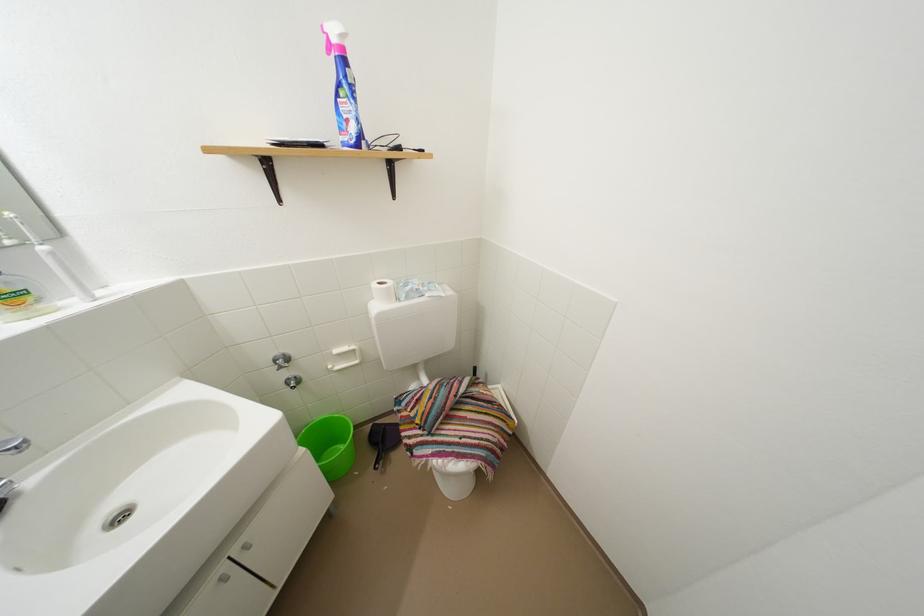
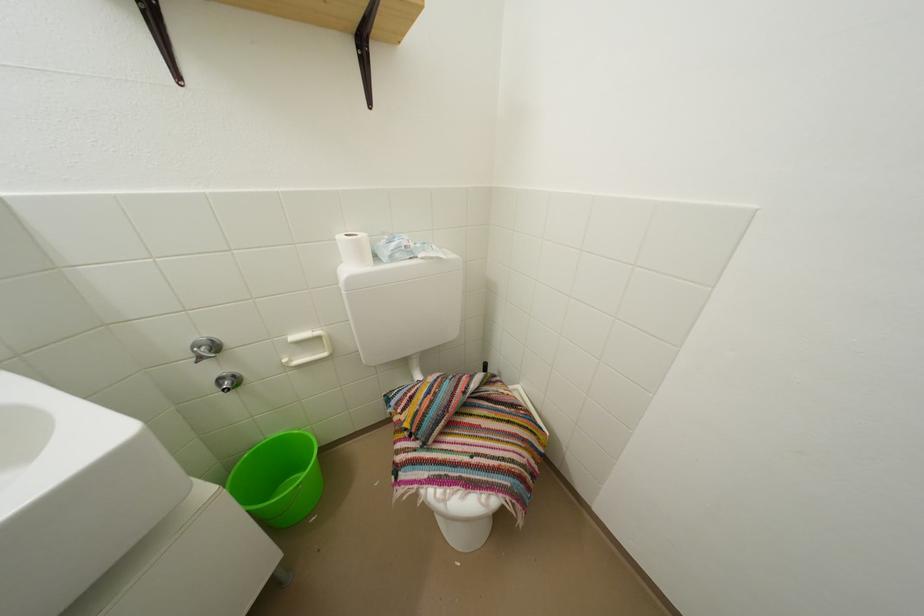
Find the pixel in the second image that matches (x=417, y=294) in the first image.

(402, 251)